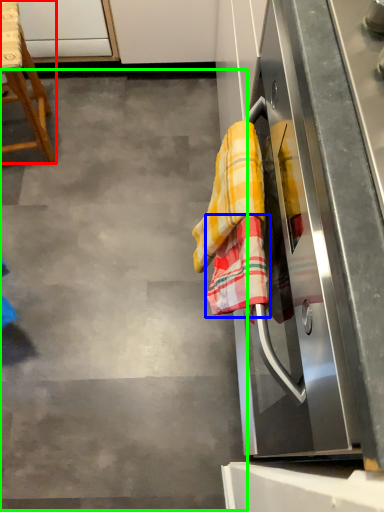
Question: Considering the real-world distances, which object is farthest from furniture (highlighted by a red box)? beach towel (highlighted by a blue box) or concrete (highlighted by a green box)?

Choices:
 (A) beach towel
 (B) concrete

Answer: (A)